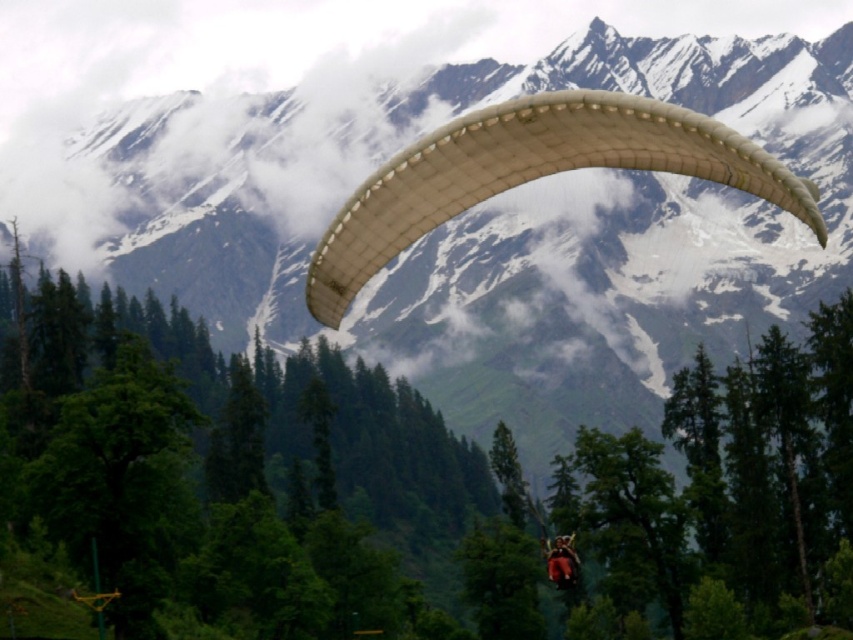
You are a hiker standing at the base of the mountain looking up. You see the white fabric parachute at upper center and the matte white paraglider at center. Which object is positioned to the left when viewed from your perspective?

The white fabric parachute at upper center is positioned to the left of the matte white paraglider at center from your perspective.

You are a paraglider pilot preparing to land. You see the point at coordinates [532,173] in the image. Is this point located on the white fabric parachute at center?

Yes, the point at coordinates [532,173] is located on the white fabric parachute at center as stated in the Objects Description.